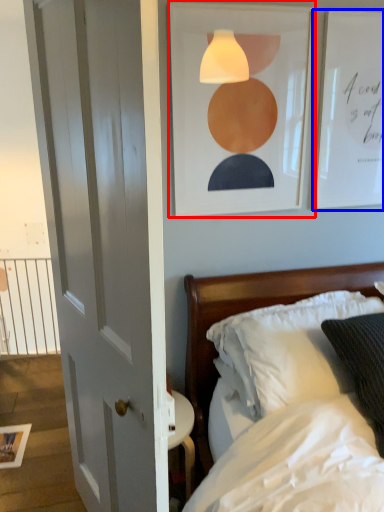
Question: Among these objects, which one is nearest to the camera, picture frame (highlighted by a red box) or picture frame (highlighted by a blue box)?

Choices:
 (A) picture frame
 (B) picture frame

Answer: (A)